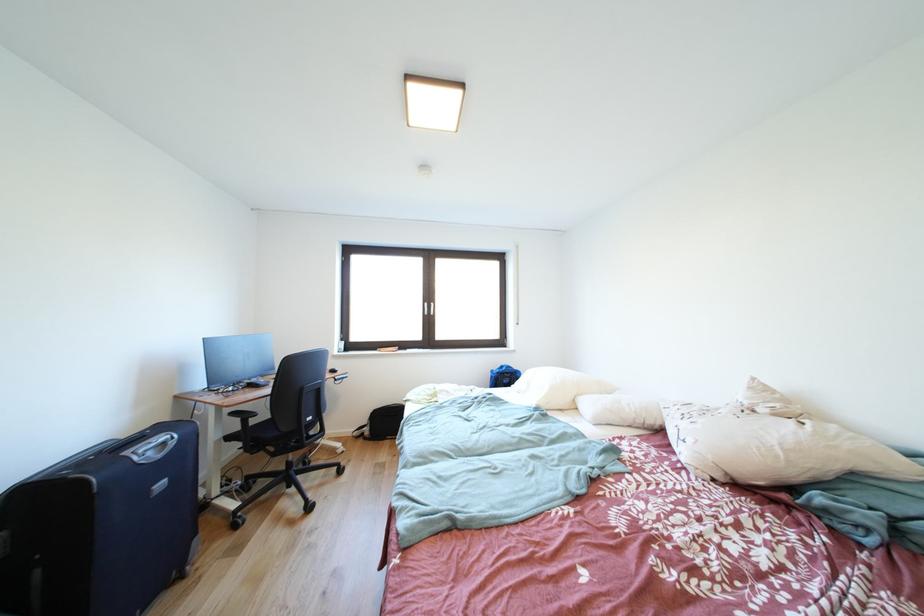
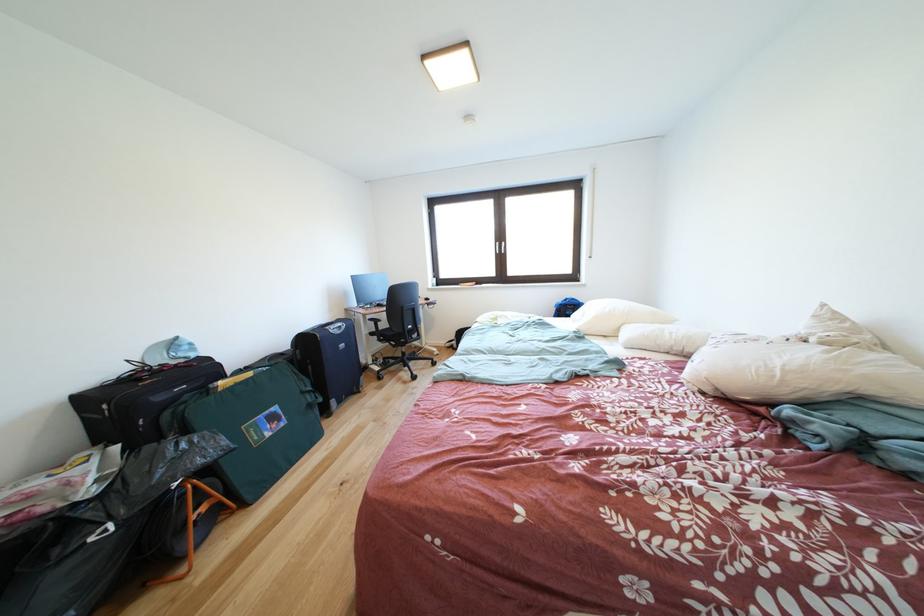
Where in the second image is the point corresponding to point 434,310 from the first image?

(505, 249)